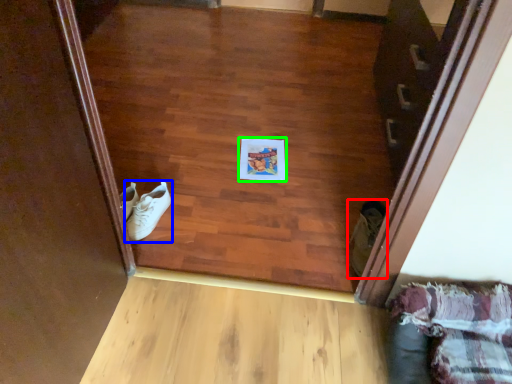
Question: Which object is the farthest from footwear (highlighted by a red box)? Choose among these: footwear (highlighted by a blue box) or copy (highlighted by a green box).

Choices:
 (A) footwear
 (B) copy

Answer: (A)